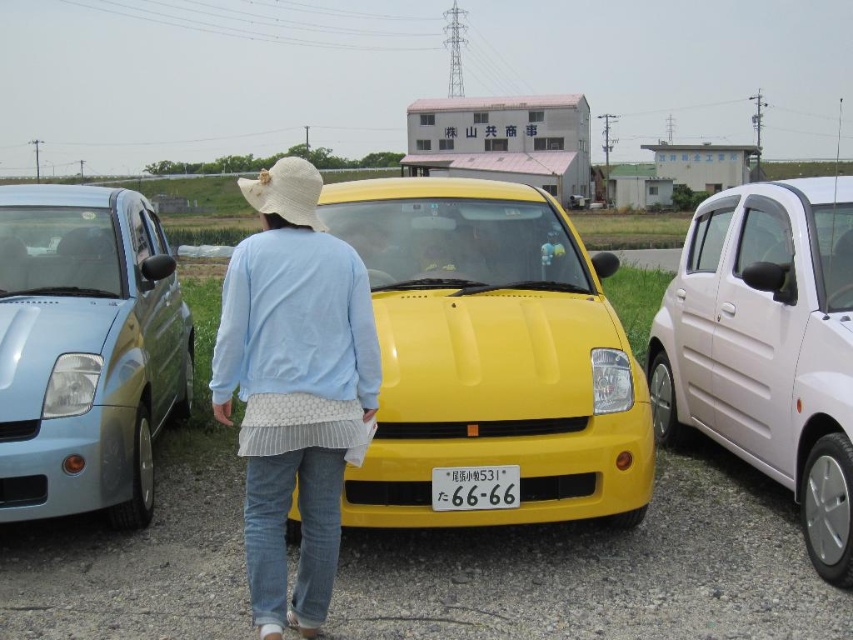
Consider the image. Measure the distance between yellow matte car at center and matte metallic car at left.

yellow matte car at center is 6.58 feet from matte metallic car at left.

Does yellow matte car at center have a smaller size compared to matte metallic car at left?

Correct, yellow matte car at center occupies less space than matte metallic car at left.

Between point (492, 214) and point (134, 426), which one is positioned in front?

Point (134, 426)

Where is `yellow matte car at center`? This screenshot has width=853, height=640. yellow matte car at center is located at coordinates (491, 355).

Consider the image. Does yellow matte car at center appear under white plastic license plate at center?

Incorrect, yellow matte car at center is not positioned below white plastic license plate at center.

Where is `yellow matte car at center`? The width and height of the screenshot is (853, 640). yellow matte car at center is located at coordinates (491, 355).

Image resolution: width=853 pixels, height=640 pixels. I want to click on yellow matte car at center, so pos(491,355).

Which of these two, white matte car at right or light blue fabric at center, stands taller?

light blue fabric at center is taller.

Can you confirm if white matte car at right is bigger than light blue fabric at center?

Incorrect, white matte car at right is not larger than light blue fabric at center.

At what (x,y) coordinates should I click in order to perform the action: click on white matte car at right. Please return your answer as a coordinate pair (x, y). This screenshot has height=640, width=853. Looking at the image, I should click on (767, 346).

Identify the location of white matte car at right. The height and width of the screenshot is (640, 853). click(x=767, y=346).